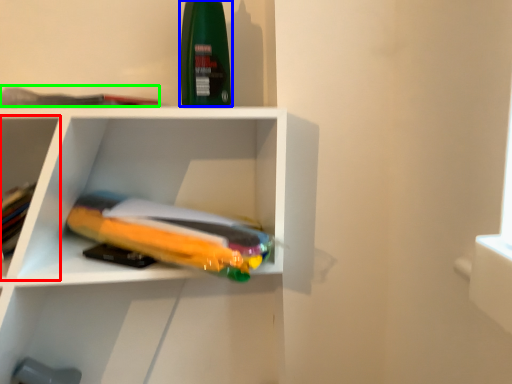
Question: Which is nearer to the shelf (highlighted by a red box)? cleaning product (highlighted by a blue box) or book (highlighted by a green box).

Choices:
 (A) cleaning product
 (B) book

Answer: (B)